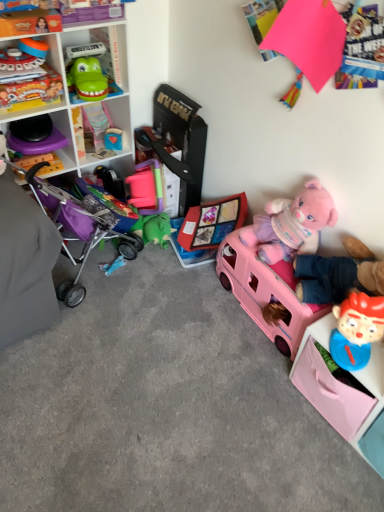
Question: Is pink plastic shelf at lower right, which is counted as the 2th shelf, starting from the top, placed right next to green plastic toy at upper left, placed as the 1th cabinet when sorted from top to bottom?

Choices:
 (A) yes
 (B) no

Answer: (B)

Question: Is pink plastic shelf at lower right, the 2th shelf viewed from the left, positioned with its back to green plastic toy at upper left, the 2th cabinet from the bottom?

Choices:
 (A) no
 (B) yes

Answer: (A)

Question: From a real-world perspective, is pink plastic shelf at lower right, which is the first shelf in right-to-left order, over green plastic toy at upper left, the second cabinet in the left-to-right sequence?

Choices:
 (A) yes
 (B) no

Answer: (B)

Question: Is the position of pink plastic shelf at lower right, which is counted as the 2th shelf, starting from the top, more distant than that of green plastic toy at upper left, placed as the 1th cabinet when sorted from top to bottom?

Choices:
 (A) yes
 (B) no

Answer: (B)

Question: Considering the relative sizes of pink plastic shelf at lower right, the 2th shelf viewed from the left, and green plastic toy at upper left, arranged as the first cabinet when viewed from the right, in the image provided, is pink plastic shelf at lower right, the 2th shelf viewed from the left, taller than green plastic toy at upper left, arranged as the first cabinet when viewed from the right,?

Choices:
 (A) yes
 (B) no

Answer: (A)

Question: Is green plastic toy at upper left, the second cabinet in the left-to-right sequence, in front of or behind purple fabric stroller at left in the image?

Choices:
 (A) front
 (B) behind

Answer: (B)

Question: Choose the correct answer: Is green plastic toy at upper left, arranged as the first cabinet when viewed from the right, inside purple fabric stroller at left or outside it?

Choices:
 (A) inside
 (B) outside

Answer: (B)

Question: From their relative heights in the image, would you say green plastic toy at upper left, the second cabinet in the left-to-right sequence, is taller or shorter than purple fabric stroller at left?

Choices:
 (A) tall
 (B) short

Answer: (B)

Question: Looking at their shapes, would you say green plastic toy at upper left, arranged as the first cabinet when viewed from the right, is wider or thinner than purple fabric stroller at left?

Choices:
 (A) wide
 (B) thin

Answer: (B)

Question: Is pink plush bear at right, which ranks as the second toy in right-to-left order, wider or thinner than pink plastic shelf at lower right, which is counted as the 2th shelf, starting from the top?

Choices:
 (A) wide
 (B) thin

Answer: (B)

Question: In terms of height, does pink plush bear at right, which appears as the sixth toy when viewed from the left, look taller or shorter compared to pink plastic shelf at lower right, which is counted as the 2th shelf, starting from the top?

Choices:
 (A) short
 (B) tall

Answer: (B)

Question: From the image's perspective, is pink plush bear at right, which appears as the sixth toy when viewed from the left, positioned above or below pink plastic shelf at lower right, which is the 1th shelf in bottom-to-top order?

Choices:
 (A) below
 (B) above

Answer: (B)

Question: In the image, is pink plush bear at right, which appears as the sixth toy when viewed from the left, on the left side or the right side of pink plastic shelf at lower right, which is counted as the 2th shelf, starting from the top?

Choices:
 (A) right
 (B) left

Answer: (B)

Question: Based on their positions, is matte plastic shelf at upper left, the second shelf when ordered from right to left, located to the left or right of purple fabric stroller at left?

Choices:
 (A) left
 (B) right

Answer: (A)

Question: Is matte plastic shelf at upper left, which is the 2th shelf from bottom to top, bigger or smaller than purple fabric stroller at left?

Choices:
 (A) big
 (B) small

Answer: (A)